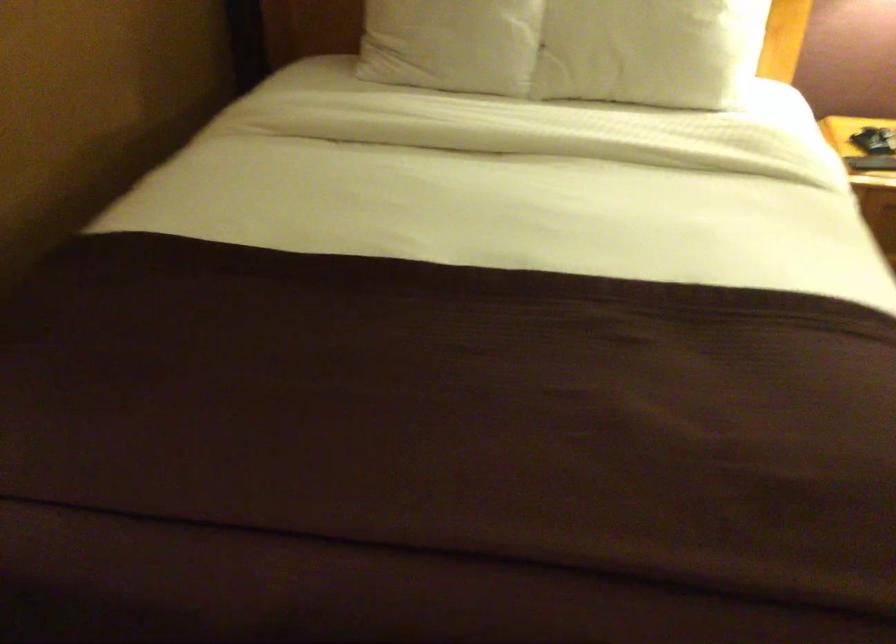
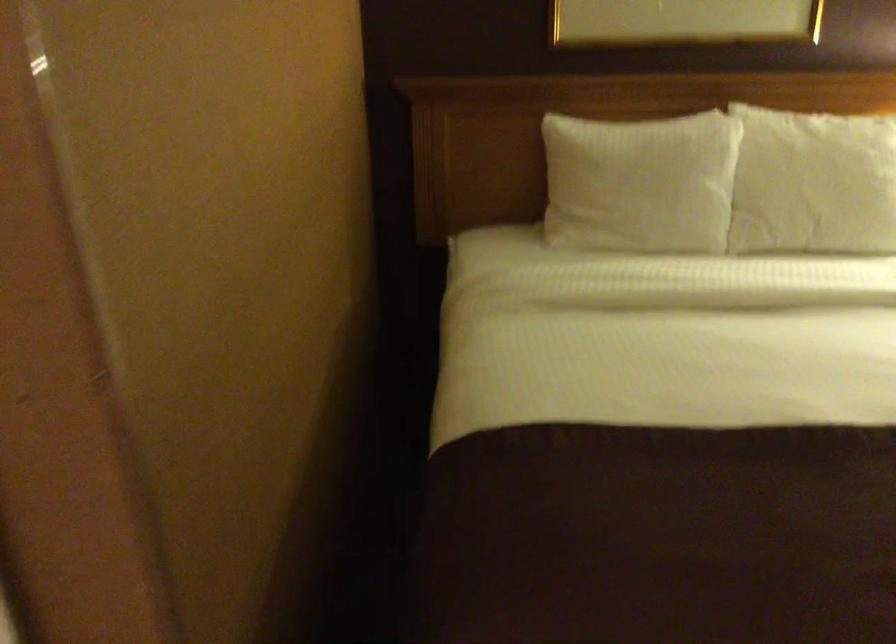
Question: Based on the continuous images, in which direction is the camera rotating? Reply with the corresponding letter.

Choices:
 (A) Left
 (B) Right
 (C) Up
 (D) Down

Answer: (C)